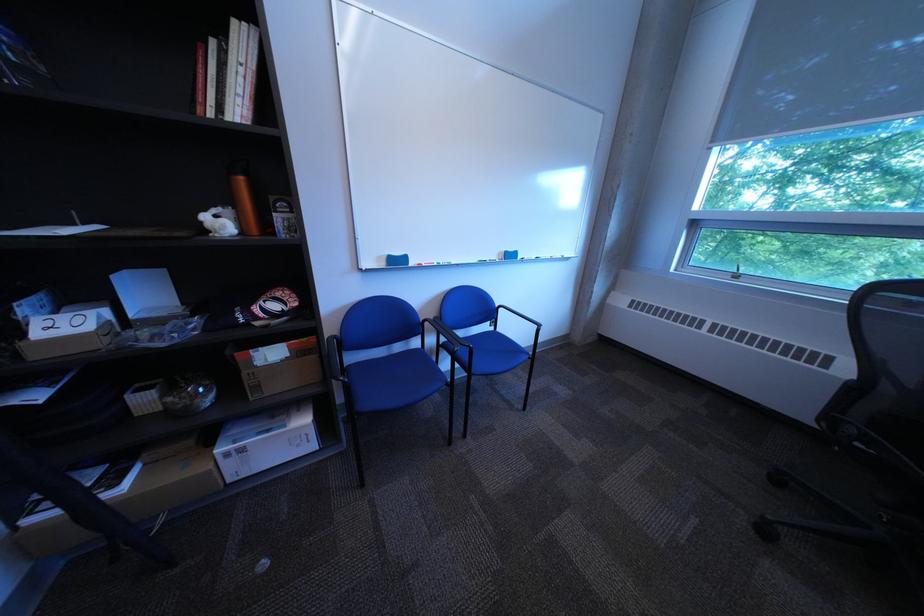
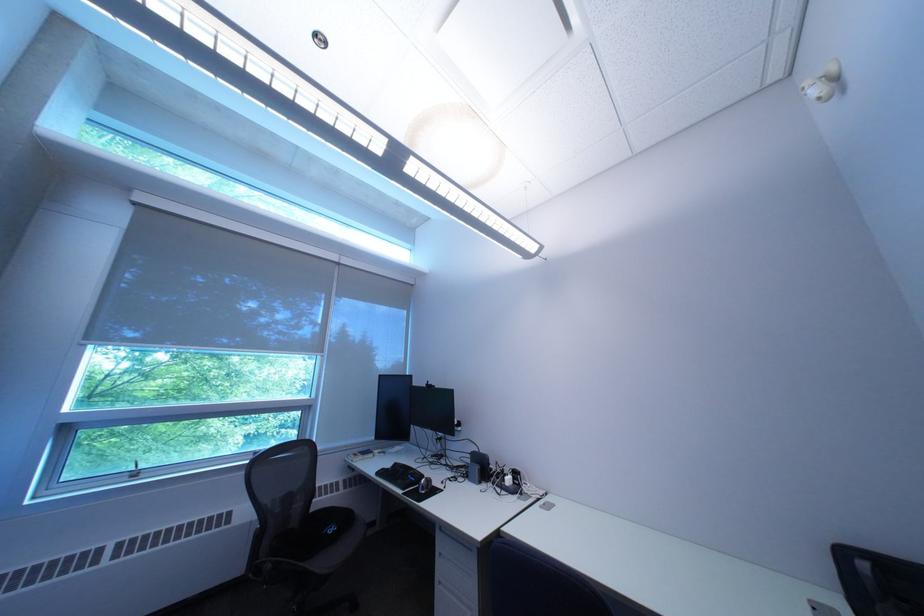
Where in the second image is the point corresponding to point (868, 432) from the first image?

(285, 568)